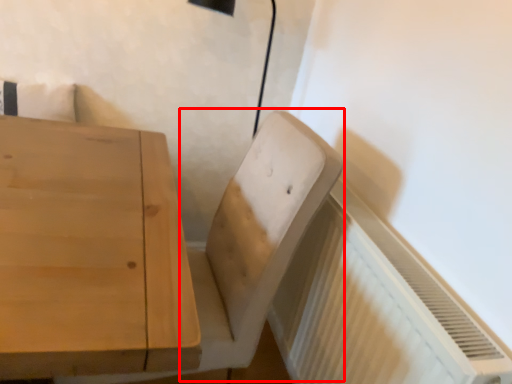
Question: From the image's perspective, what is the correct spatial positioning of swivel chair (annotated by the red box) in reference to radiator?

Choices:
 (A) above
 (B) below

Answer: (A)